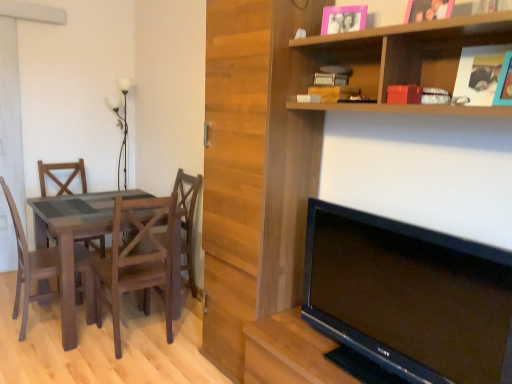
Question: Considering the relative positions of wooden book at upper center and wooden shelf at upper right in the image provided, is wooden book at upper center to the left or to the right of wooden shelf at upper right?

Choices:
 (A) left
 (B) right

Answer: (A)

Question: Choose the correct answer: Is wooden book at upper center inside wooden shelf at upper right or outside it?

Choices:
 (A) outside
 (B) inside

Answer: (B)

Question: Based on their relative distances, which object is nearer to the black glossy tv at lower right?

Choices:
 (A) pink matte picture frame at upper center, which is counted as the 2th picture frame, starting from the back
 (B) wooden chair at center, the first chair positioned from the right
 (C) white glass lamp at upper left
 (D) wooden chair at left, which appears as the first chair when viewed from the left
 (E) wooden textured chair at left, positioned as the 2th chair in right-to-left order

Answer: (A)

Question: Which object is positioned farthest from the pink plastic picture frame at upper center, which is counted as the first picture frame, starting from the left?

Choices:
 (A) wooden chair at left, arranged as the 3th chair when viewed from the right
 (B) pink matte picture frame at upper center, the first picture frame in the front-to-back sequence
 (C) white glass lamp at upper left
 (D) wooden textured chair at left, positioned as the 2th chair in right-to-left order
 (E) wooden shelf at upper right

Answer: (C)